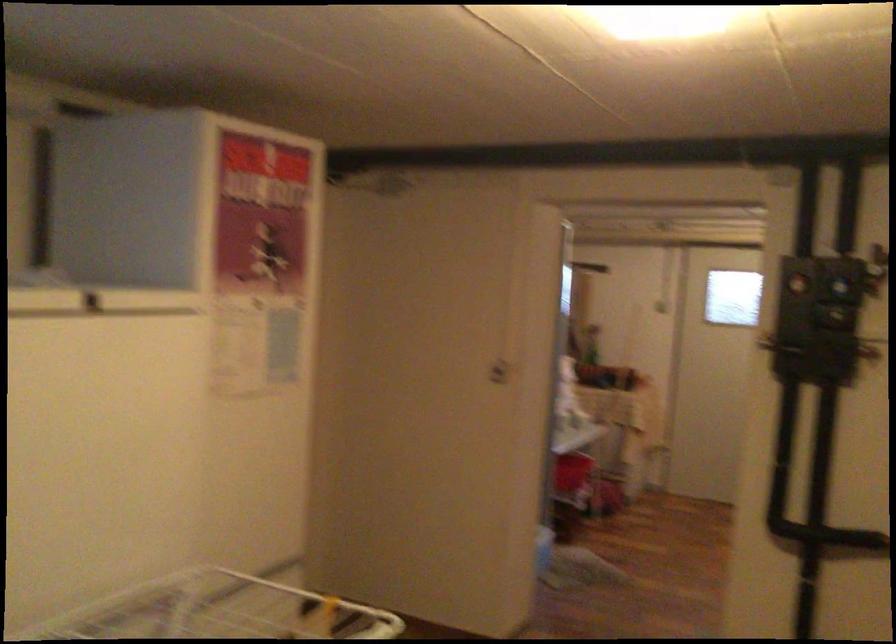
Describe the element at coordinates (498, 372) in the screenshot. Image resolution: width=896 pixels, height=644 pixels. I see `the white door handle` at that location.